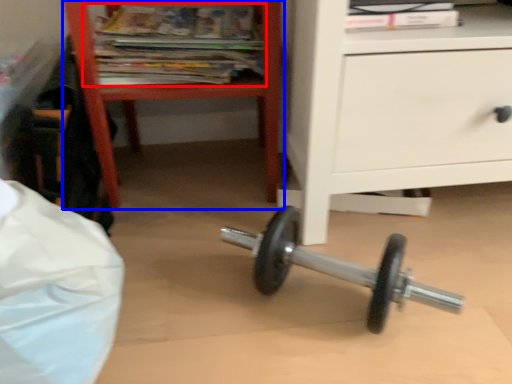
Question: Which object is closer to the camera taking this photo, magazine (highlighted by a red box) or furniture (highlighted by a blue box)?

Choices:
 (A) magazine
 (B) furniture

Answer: (B)